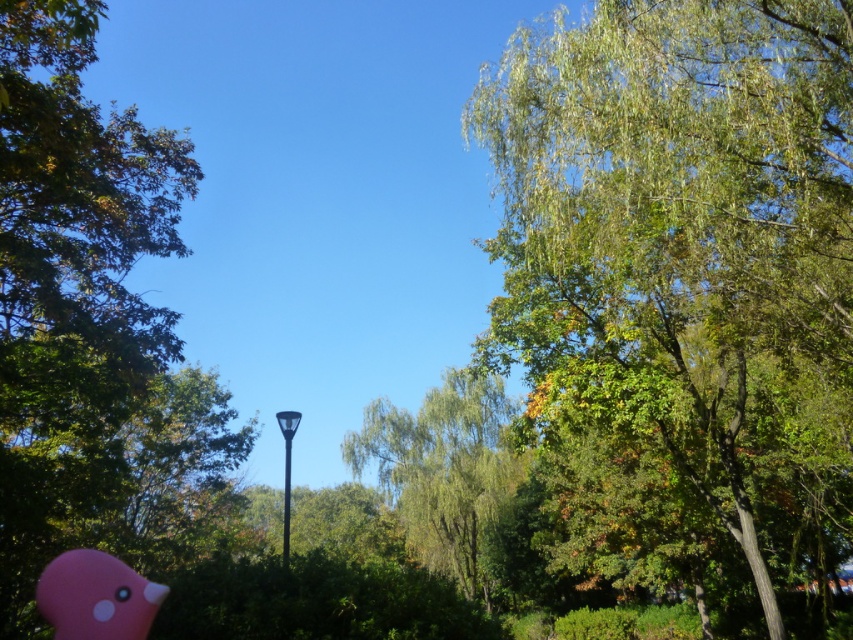
You are planning to hang a bird feeder in the scene. The bird feeder requires a sturdy branch that can support its weight. Based on the sizes of the green leafy tree at upper right and the green leafy tree at center, which tree would you choose for hanging the bird feeder?

The green leafy tree at upper right has a larger size compared to the green leafy tree at center, so it would likely have sturdier branches capable of supporting the bird feeder.

You are standing at the bottom left corner of the image and want to walk towards the lamppost in the midground. There are two points marked on the path you need to cross. The first point is at point (70, 164) and the second point is at point (285, 544). Which point will you encounter first on your path?

Point (70, 164) is in front of point (285, 544), so you will encounter point (70, 164) first on your path towards the lamppost.

You are a bird flying towards the green leafy tree at upper right and the green leafy tree at center. Which tree will you reach first?

The green leafy tree at upper right is in front of the green leafy tree at center, so you will reach the green leafy tree at upper right first.